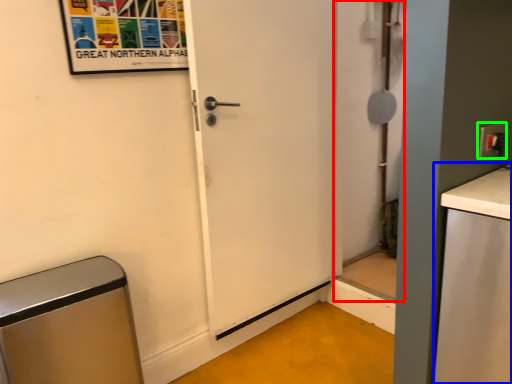
Question: Estimate the real-world distances between objects in this image. Which object is closer to screen door (highlighted by a red box), counter top (highlighted by a blue box) or electric outlet (highlighted by a green box)?

Choices:
 (A) counter top
 (B) electric outlet

Answer: (A)